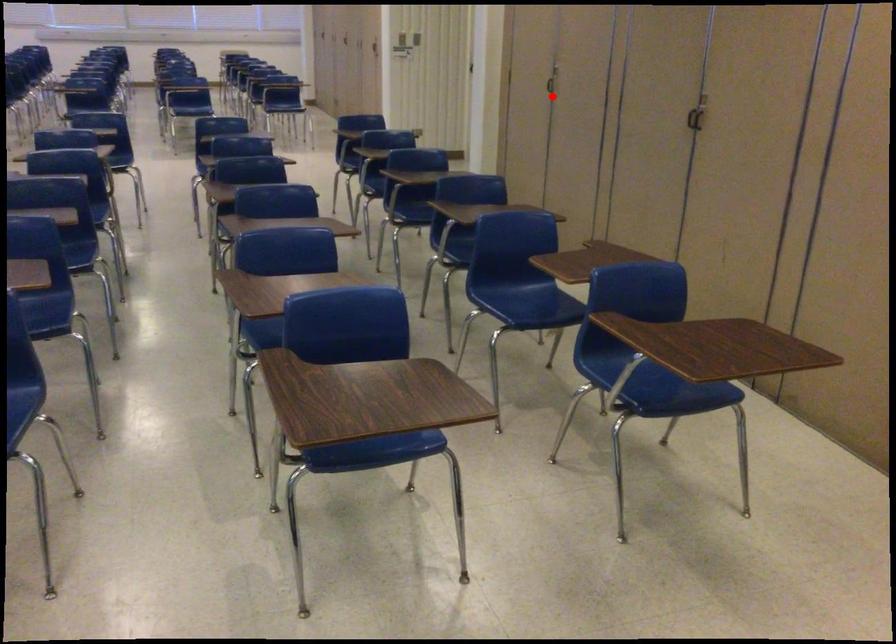
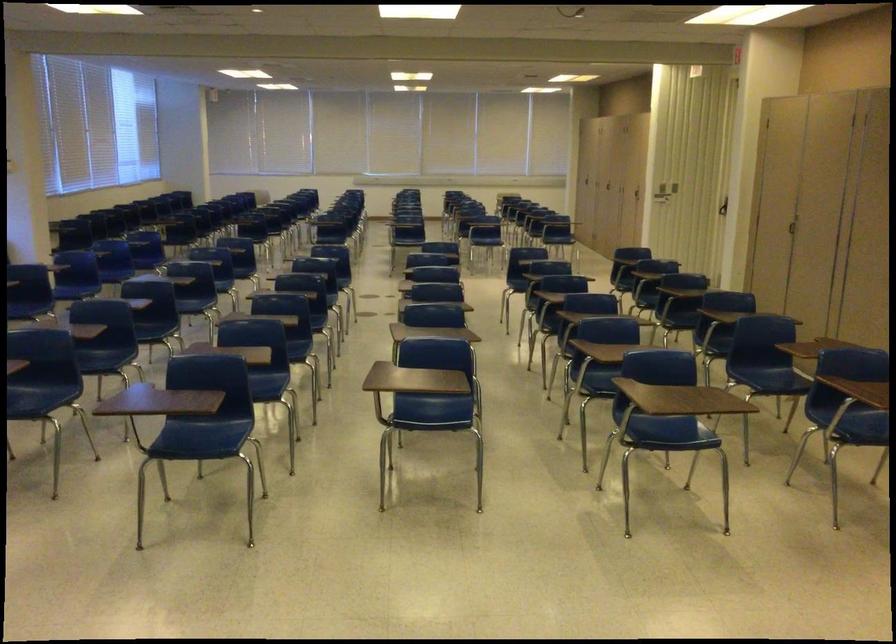
Locate, in the second image, the point that corresponds to the highlighted location in the first image.

(794, 228)